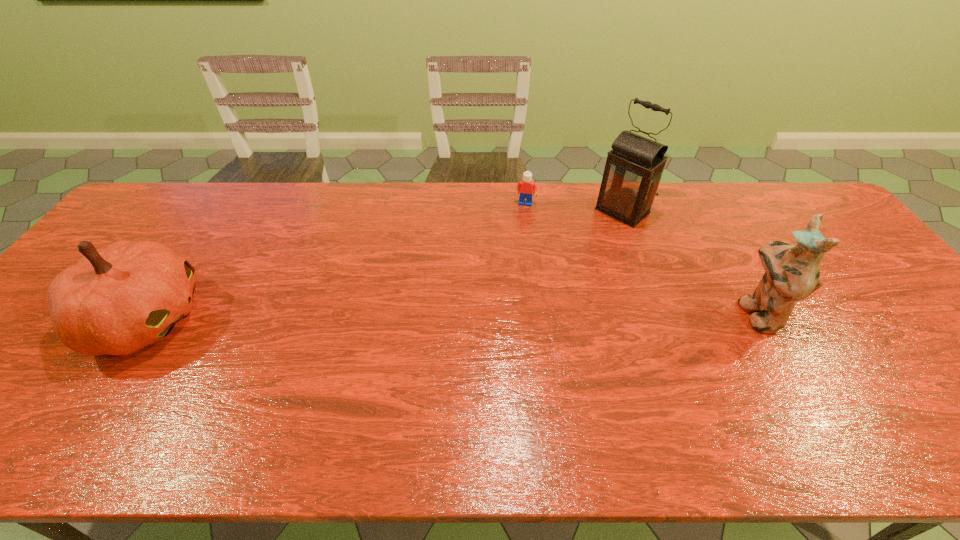
Find the location of `vacant position at the far edge of the desktop`. vacant position at the far edge of the desktop is located at coordinates (303, 213).

Locate an element on the screen. This screenshot has width=960, height=540. vacant region at the near edge is located at coordinates (135, 381).

Where is `blank space at the right edge`? blank space at the right edge is located at coordinates (856, 253).

What are the coordinates of `free space between the second object from right to left and the second shortest object` in the screenshot? It's located at (384, 265).

Find the location of a particular element. Image resolution: width=960 pixels, height=540 pixels. vacant area that lies between the leftmost object and the figurine is located at coordinates (451, 316).

Where is `vacant area that lies between the leftmost object and the figurine`? This screenshot has height=540, width=960. vacant area that lies between the leftmost object and the figurine is located at coordinates (451, 316).

I want to click on free space that is in between the shortest object and the lantern, so click(x=574, y=207).

Locate an element on the screen. Image resolution: width=960 pixels, height=540 pixels. free space between the second object from left to right and the pumpkin is located at coordinates (336, 261).

The width and height of the screenshot is (960, 540). Identify the location of vacant area that lies between the shortest object and the rightmost object. (641, 258).

At what (x,y) coordinates should I click in order to perform the action: click on free spot between the Lego and the figurine. Please return your answer as a coordinate pair (x, y). Looking at the image, I should click on (641, 258).